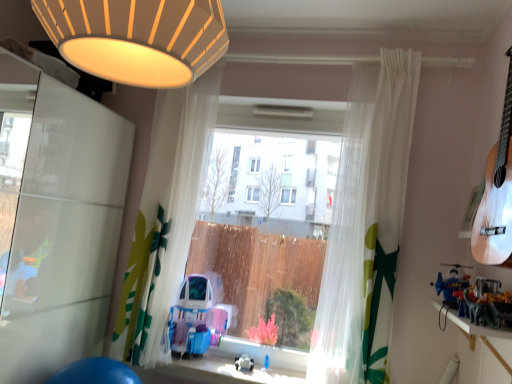
The width and height of the screenshot is (512, 384). What are the coordinates of `translucent fabric curtain at center, placed as the second curtain when sorted from left to right` in the screenshot? It's located at click(x=366, y=224).

The height and width of the screenshot is (384, 512). Identify the location of white glossy screen door at left. (56, 222).

What do you see at coordinates (269, 233) in the screenshot? I see `transparent plastic window at center` at bounding box center [269, 233].

The image size is (512, 384). What are the coordinates of `blue plastic helicopter at right, which is the second toy in bottom-to-top order` in the screenshot? It's located at (452, 284).

Locate an element on the screen. The height and width of the screenshot is (384, 512). white matte guitar at right is located at coordinates (497, 194).

From a real-world perspective, relative to wooden shelf at lower right, is blue plastic helicopter at right, which is the second toy in top-to-bottom order, vertically above or below?

In terms of real-world spatial position, blue plastic helicopter at right, which is the second toy in top-to-bottom order, is above wooden shelf at lower right.

Which of these two, blue plastic helicopter at right, the 3th toy in the left-to-right sequence, or wooden shelf at lower right, is thinner?

Thinner between the two is blue plastic helicopter at right, the 3th toy in the left-to-right sequence.

Which object is closer to the camera taking this photo, blue plastic helicopter at right, which is the second toy in top-to-bottom order, or wooden shelf at lower right?

wooden shelf at lower right.

How far apart are translucent fabric curtain at center, marked as the 1th curtain in a right-to-left arrangement, and white sheer curtain at center, the first curtain viewed from the left?

translucent fabric curtain at center, marked as the 1th curtain in a right-to-left arrangement, is 3.44 feet from white sheer curtain at center, the first curtain viewed from the left.

Can you confirm if translucent fabric curtain at center, marked as the 1th curtain in a right-to-left arrangement, is shorter than white sheer curtain at center, positioned as the second curtain in right-to-left order?

Yes.

Which is more to the left, translucent fabric curtain at center, marked as the 1th curtain in a right-to-left arrangement, or white sheer curtain at center, positioned as the second curtain in right-to-left order?

Positioned to the left is white sheer curtain at center, positioned as the second curtain in right-to-left order.

Can you confirm if translucent fabric curtain at center, placed as the second curtain when sorted from left to right, is thinner than white sheer curtain at center, positioned as the second curtain in right-to-left order?

Yes, translucent fabric curtain at center, placed as the second curtain when sorted from left to right, is thinner than white sheer curtain at center, positioned as the second curtain in right-to-left order.

Does white sheer curtain at center, positioned as the second curtain in right-to-left order, contain white glossy screen door at left?

No, white glossy screen door at left is not inside white sheer curtain at center, positioned as the second curtain in right-to-left order.

Considering the relative sizes of white sheer curtain at center, the first curtain viewed from the left, and white glossy screen door at left in the image provided, is white sheer curtain at center, the first curtain viewed from the left, wider than white glossy screen door at left?

In fact, white sheer curtain at center, the first curtain viewed from the left, might be narrower than white glossy screen door at left.

The width and height of the screenshot is (512, 384). Identify the location of the 2nd curtain behind the white glossy screen door at left, counting from the anchor's position. (172, 207).

Can you confirm if white plastic toy at center, the first toy viewed from the left, is smaller than translucent fabric curtain at center, marked as the 1th curtain in a right-to-left arrangement?

Correct, white plastic toy at center, the first toy viewed from the left, occupies less space than translucent fabric curtain at center, marked as the 1th curtain in a right-to-left arrangement.

From the picture: From the image's perspective, is white plastic toy at center, the third toy from the top, over translucent fabric curtain at center, placed as the second curtain when sorted from left to right?

Actually, white plastic toy at center, the third toy from the top, appears below translucent fabric curtain at center, placed as the second curtain when sorted from left to right, in the image.

Visually, is white plastic toy at center, acting as the 3th toy starting from the front, positioned to the left or to the right of translucent fabric curtain at center, placed as the second curtain when sorted from left to right?

white plastic toy at center, acting as the 3th toy starting from the front, is to the left of translucent fabric curtain at center, placed as the second curtain when sorted from left to right.

Which object is closer to the camera taking this photo, transparent plastic window at center or matte yellow lampshade at upper center?

matte yellow lampshade at upper center is more forward.

Is transparent plastic window at center oriented towards matte yellow lampshade at upper center?

Yes, transparent plastic window at center is oriented towards matte yellow lampshade at upper center.

Looking at this image, does transparent plastic window at center have a smaller size compared to matte yellow lampshade at upper center?

No.

Is transparent plastic window at center next to matte yellow lampshade at upper center?

No.

Would you say white plastic toy at center, which appears as the first toy when viewed from the back, contains white matte guitar at right?

That's incorrect, white matte guitar at right is not inside white plastic toy at center, which appears as the first toy when viewed from the back.

In terms of size, does white plastic toy at center, which appears as the first toy when viewed from the back, appear bigger or smaller than white matte guitar at right?

white plastic toy at center, which appears as the first toy when viewed from the back, is smaller than white matte guitar at right.

Between white glossy screen door at left and white plastic toy at center, the third toy from the top, which one is positioned in front?

white glossy screen door at left is closer to the camera.

Is white glossy screen door at left in contact with white plastic toy at center, the third toy from the top?

No, white glossy screen door at left is not making contact with white plastic toy at center, the third toy from the top.

Would you say white glossy screen door at left contains white plastic toy at center, marked as the 3th toy in a right-to-left arrangement?

Definitely not — white plastic toy at center, marked as the 3th toy in a right-to-left arrangement, is not inside white glossy screen door at left.

From the image's perspective, count 3rd toys downward from the white glossy screen door at left and point to it. Please provide its 2D coordinates.

[(244, 363)]

Find the location of `window sill on the left of blue plastic helicopter at right, the 2th toy in the front-to-back sequence`. window sill on the left of blue plastic helicopter at right, the 2th toy in the front-to-back sequence is located at coordinates (471, 324).

Find the location of a particular element. The height and width of the screenshot is (384, 512). curtain that is above the white sheer curtain at center, positioned as the second curtain in right-to-left order (from a real-world perspective) is located at coordinates (366, 224).

Considering their positions, is transparent plastic window at center positioned further to white matte guitar at right than matte yellow lampshade at upper center?

transparent plastic window at center lies further to white matte guitar at right than the other object.

From the image, which object appears to be farther from white glossy screen door at left, blue plastic helicopter at right, which is the second toy in top-to-bottom order, or translucent fabric curtain at center, marked as the 1th curtain in a right-to-left arrangement?

The object further to white glossy screen door at left is blue plastic helicopter at right, which is the second toy in top-to-bottom order.

Looking at the image, which one is located closer to white plastic toy at center, acting as the 3th toy starting from the front, transparent plastic window at center or white sheer curtain at center, the first curtain viewed from the left?

The object closer to white plastic toy at center, acting as the 3th toy starting from the front, is transparent plastic window at center.

Looking at the image, which one is located closer to white matte guitar at right, translucent fabric curtain at center, placed as the second curtain when sorted from left to right, or white glossy screen door at left?

translucent fabric curtain at center, placed as the second curtain when sorted from left to right, is positioned closer to the anchor white matte guitar at right.

When comparing their distances from matte yellow lampshade at upper center, does white plastic toy at center, marked as the 3th toy in a right-to-left arrangement, or translucent fabric curtain at center, placed as the second curtain when sorted from left to right, seem further?

Based on the image, white plastic toy at center, marked as the 3th toy in a right-to-left arrangement, appears to be further to matte yellow lampshade at upper center.

Considering their positions, is white sheer curtain at center, positioned as the second curtain in right-to-left order, positioned closer to metallic silver dinosaur at right, which is the 3th toy in back-to-front order, than transparent plastic window at center?

The object closer to metallic silver dinosaur at right, which is the 3th toy in back-to-front order, is transparent plastic window at center.

When comparing their distances from blue plastic helicopter at right, the first toy from the right, does white sheer curtain at center, the first curtain viewed from the left, or white matte guitar at right seem further?

white sheer curtain at center, the first curtain viewed from the left, lies further to blue plastic helicopter at right, the first toy from the right, than the other object.

Based on the photo, when comparing their distances from white glossy screen door at left, does blue plastic helicopter at right, which is the second toy in top-to-bottom order, or white matte guitar at right seem further?

white matte guitar at right is positioned further to the anchor white glossy screen door at left.

Identify the location of bay window situated between white sheer curtain at center, the first curtain viewed from the left, and blue plastic helicopter at right, the 3th toy in the left-to-right sequence, from left to right. (269, 233).

At what (x,y) coordinates should I click in order to perform the action: click on window sill located between white sheer curtain at center, positioned as the second curtain in right-to-left order, and metallic silver dinosaur at right, the second toy from the right, in the left-right direction. Please return your answer as a coordinate pair (x, y). Looking at the image, I should click on (471, 324).

Find the location of a particular element. Image resolution: width=512 pixels, height=384 pixels. bay window located between white plastic toy at center, which is the 1th toy in bottom-to-top order, and blue plastic helicopter at right, the 2th toy when ordered from back to front, in the left-right direction is located at coordinates (269, 233).

The image size is (512, 384). I want to click on toy between white sheer curtain at center, positioned as the second curtain in right-to-left order, and metallic silver dinosaur at right, arranged as the 1th toy when viewed from the front, from left to right, so click(244, 363).